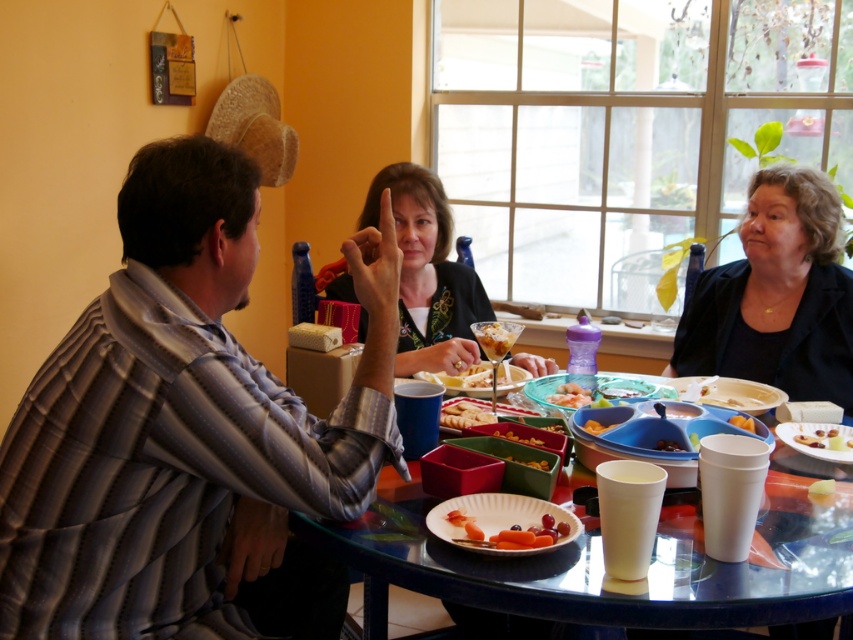
You are a parent at the gathering and want to place both the carrot sticks at center and the smooth white cheese at center on a small plate that can only hold items up to 3 inches in height. Which item might not fit if the cheese is already on the plate?

The smooth white cheese at center is taller than the carrot sticks at center. Since the cheese is already on the plate and it is taller, placing both might exceed the 3 inches height limit. The cheese might not fit if the plate can only hold up to 3 inches, depending on its exact height.

You are a parent at the gathering and want to place a small toy between the carrot sticks at center and the smooth white cheese at center on the table. Where should you position the toy to ensure it is between them?

The carrot sticks at center is below the smooth white cheese at center, so you should place the toy between them vertically, positioning it above the carrot sticks at center and below the smooth white cheese at center.